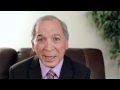
Find the location of a particular element. This screenshot has width=120, height=90. wall is located at coordinates (86, 31).